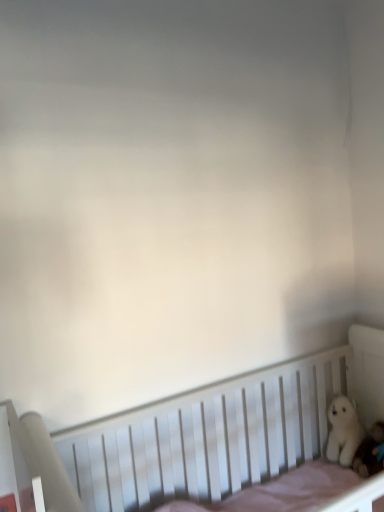
Question: Is white plush toy at lower right, marked as the first toy in a front-to-back arrangement, taller than white plush bear at right, positioned as the first toy in back-to-front order?

Choices:
 (A) yes
 (B) no

Answer: (B)

Question: Is white plush toy at lower right, acting as the second toy starting from the back, smaller than white plush bear at right, acting as the second toy starting from the front?

Choices:
 (A) yes
 (B) no

Answer: (A)

Question: From the image's perspective, is white plush toy at lower right, acting as the second toy starting from the back, under white plush bear at right, acting as the second toy starting from the front?

Choices:
 (A) no
 (B) yes

Answer: (B)

Question: Considering the relative sizes of white plush toy at lower right, acting as the second toy starting from the back, and white plush bear at right, positioned as the first toy in back-to-front order, in the image provided, is white plush toy at lower right, acting as the second toy starting from the back, thinner than white plush bear at right, positioned as the first toy in back-to-front order,?

Choices:
 (A) no
 (B) yes

Answer: (B)

Question: From a real-world perspective, is white plush toy at lower right, marked as the first toy in a front-to-back arrangement, on white plush bear at right, positioned as the first toy in back-to-front order?

Choices:
 (A) no
 (B) yes

Answer: (A)

Question: Based on their sizes in the image, would you say white plush toy at lower right, acting as the second toy starting from the back, is bigger or smaller than white wooden crib at lower right?

Choices:
 (A) big
 (B) small

Answer: (B)

Question: From the image's perspective, is white plush toy at lower right, acting as the second toy starting from the back, above or below white wooden crib at lower right?

Choices:
 (A) below
 (B) above

Answer: (B)

Question: Considering the positions of white plush toy at lower right, acting as the second toy starting from the back, and white wooden crib at lower right in the image, is white plush toy at lower right, acting as the second toy starting from the back, wider or thinner than white wooden crib at lower right?

Choices:
 (A) wide
 (B) thin

Answer: (B)

Question: Do you think white plush toy at lower right, marked as the first toy in a front-to-back arrangement, is within white wooden crib at lower right, or outside of it?

Choices:
 (A) outside
 (B) inside

Answer: (B)

Question: Looking at their shapes, would you say white wooden crib at lower right is wider or thinner than white plush toy at lower right, acting as the second toy starting from the back?

Choices:
 (A) wide
 (B) thin

Answer: (A)

Question: Considering the positions of point click(x=230, y=430) and point click(x=377, y=438), is point click(x=230, y=430) closer or farther from the camera than point click(x=377, y=438)?

Choices:
 (A) farther
 (B) closer

Answer: (B)

Question: Is white wooden crib at lower right inside the boundaries of white plush toy at lower right, marked as the first toy in a front-to-back arrangement, or outside?

Choices:
 (A) inside
 (B) outside

Answer: (B)

Question: In the image, is white wooden crib at lower right positioned in front of or behind white plush toy at lower right, marked as the first toy in a front-to-back arrangement?

Choices:
 (A) front
 (B) behind

Answer: (A)

Question: Relative to white plush bear at right, acting as the second toy starting from the front, is white plush toy at lower right, acting as the second toy starting from the back, in front or behind?

Choices:
 (A) front
 (B) behind

Answer: (A)

Question: Is white plush toy at lower right, marked as the first toy in a front-to-back arrangement, taller or shorter than white plush bear at right, acting as the second toy starting from the front?

Choices:
 (A) tall
 (B) short

Answer: (B)